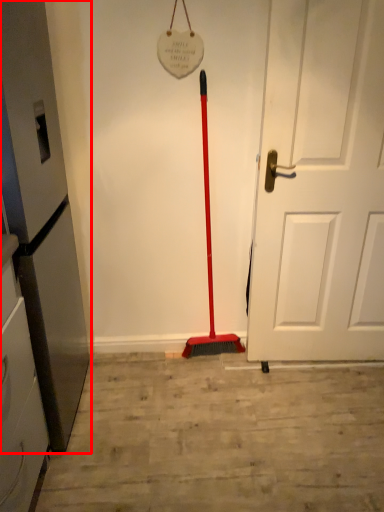
Question: From the image's perspective, where is appliance (annotated by the red box) located in relation to door in the image?

Choices:
 (A) above
 (B) below

Answer: (B)